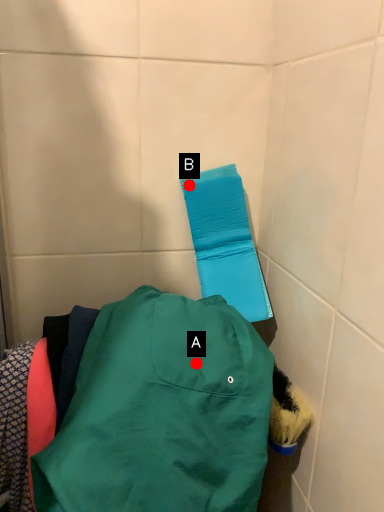
Question: Two points are circled on the image, labeled by A and B beside each circle. Among these points, which one is farthest from the camera?

Choices:
 (A) A is further
 (B) B is further

Answer: (B)